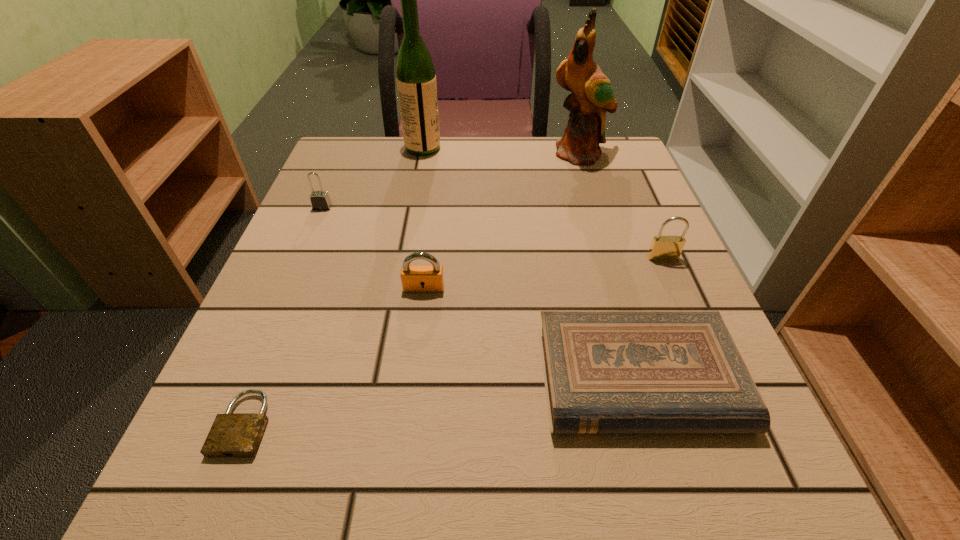
Where is `liquor`? The width and height of the screenshot is (960, 540). liquor is located at coordinates (415, 73).

The height and width of the screenshot is (540, 960). I want to click on parrot, so click(592, 95).

The height and width of the screenshot is (540, 960). Find the location of `the second farthest padlock`. the second farthest padlock is located at coordinates (663, 248).

Where is `the rightmost padlock`? the rightmost padlock is located at coordinates (663, 248).

You are a GUI agent. You are given a task and a screenshot of the screen. Output one action in this format:
    pyautogui.click(x=<x>, y=<y>)
    Task: Click on the farthest padlock
    The height and width of the screenshot is (540, 960).
    Given the screenshot: What is the action you would take?
    pyautogui.click(x=320, y=200)

At what (x,y) coordinates should I click in order to perform the action: click on the fifth farthest object. Please return your answer as a coordinate pair (x, y). Looking at the image, I should click on (414, 278).

I want to click on the second padlock from right to left, so click(x=414, y=278).

Locate an element on the screen. the second shortest object is located at coordinates (604, 371).

Find the location of `the shortest object`. the shortest object is located at coordinates (232, 434).

Locate an element on the screen. The height and width of the screenshot is (540, 960). the nearest padlock is located at coordinates (232, 434).